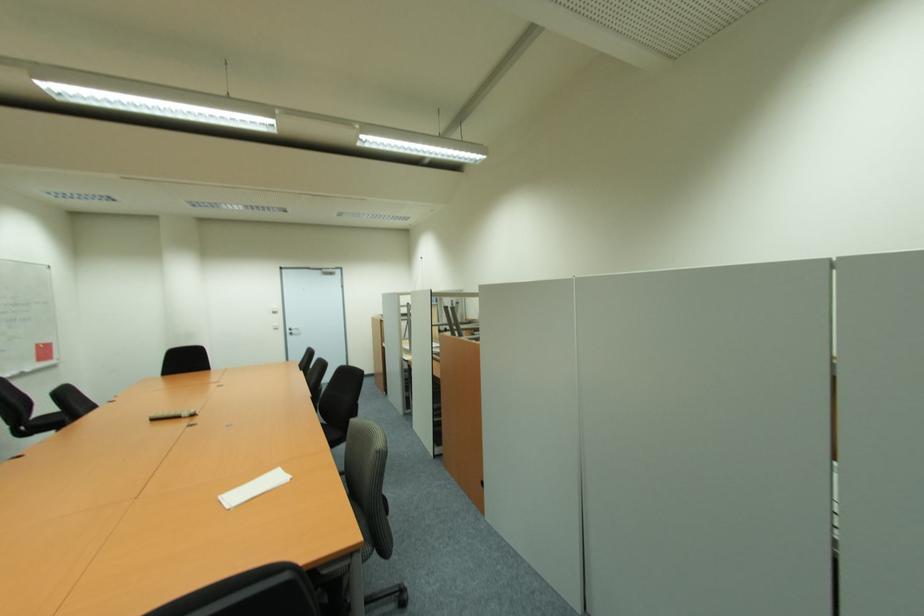
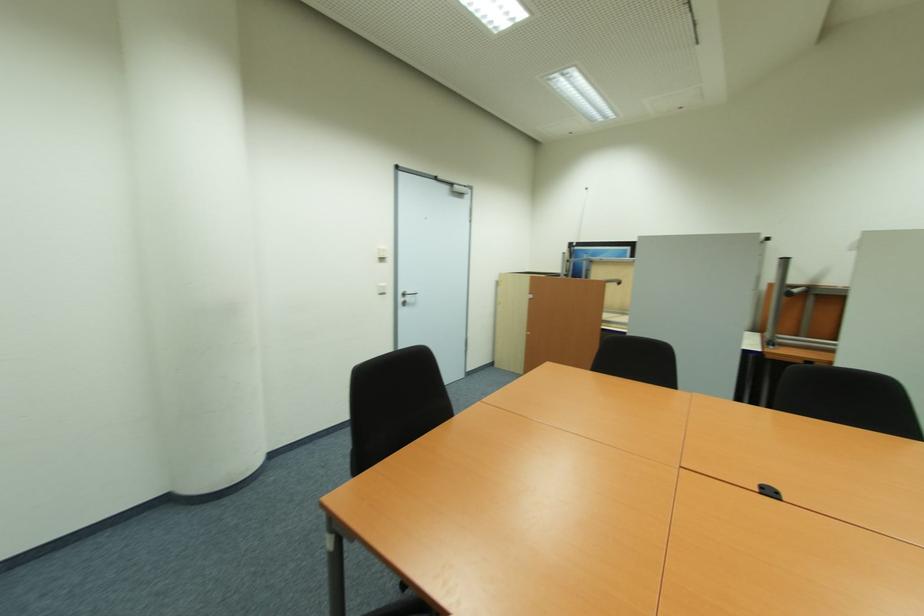
In the second image, find the point that corresponds to point 293,331 in the first image.

(405, 300)